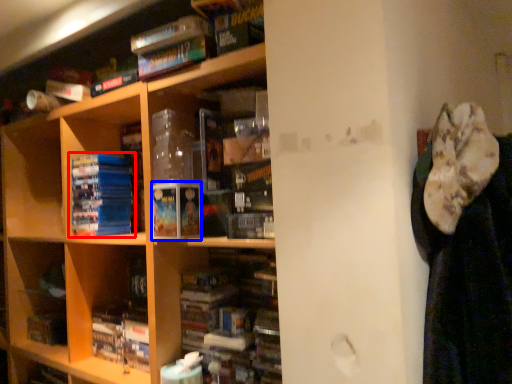
Question: Which object is further to the camera taking this photo, book (highlighted by a red box) or paperback book (highlighted by a blue box)?

Choices:
 (A) book
 (B) paperback book

Answer: (A)